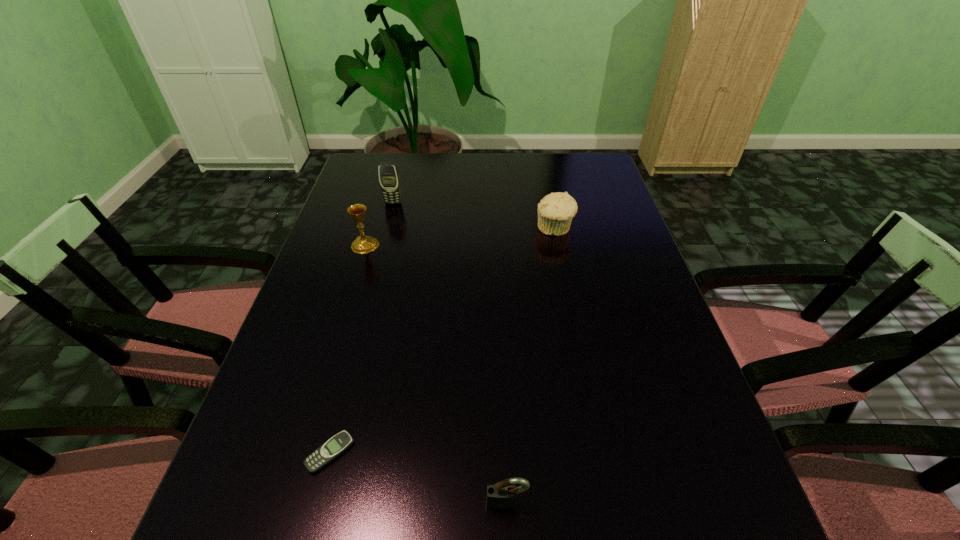
Identify which object is the fourth nearest to the nearest object. Please provide its 2D coordinates. Your answer should be formatted as a tuple, i.e. [(x, y)], where the tuple contains the x and y coordinates of a point satisfying the conditions above.

[(389, 179)]

Find the location of a particular element. The height and width of the screenshot is (540, 960). free space in the image that satisfies the following two spatial constraints: 1. on the back side of the rightmost object; 2. on the right side of the chalice is located at coordinates (371, 228).